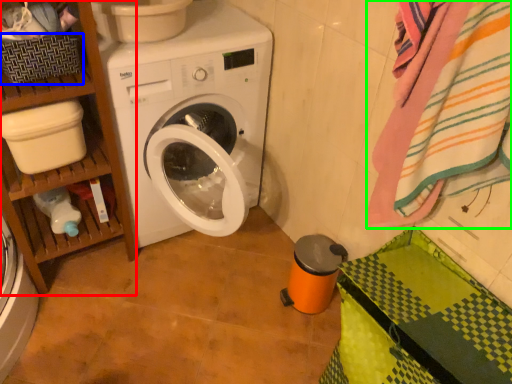
Question: Based on their relative distances, which object is farther from shelf (highlighted by a red box)? Choose from basket (highlighted by a blue box) and bath towel (highlighted by a green box).

Choices:
 (A) basket
 (B) bath towel

Answer: (B)